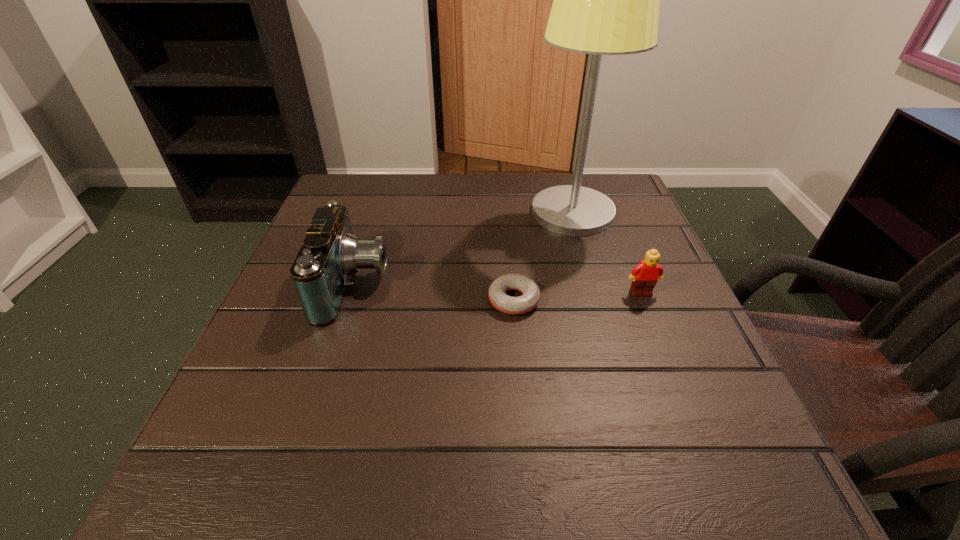
This screenshot has height=540, width=960. In order to click on free space located on the front of the shortest object in this screenshot , I will do `click(531, 508)`.

This screenshot has width=960, height=540. What are the coordinates of `object that is at the far edge` in the screenshot? It's located at (605, 0).

At what (x,y) coordinates should I click in order to perform the action: click on object located at the left edge. Please return your answer as a coordinate pair (x, y). The image size is (960, 540). Looking at the image, I should click on (330, 254).

The width and height of the screenshot is (960, 540). Find the location of `table lamp situated at the right edge`. table lamp situated at the right edge is located at coordinates 605,0.

Identify the location of Lego that is at the right edge. This screenshot has width=960, height=540. (644, 276).

In order to click on object that is at the far right corner in this screenshot , I will do point(605,0).

This screenshot has width=960, height=540. I want to click on free space at the far edge, so click(x=462, y=186).

You are a GUI agent. You are given a task and a screenshot of the screen. Output one action in this format:
    pyautogui.click(x=<x>, y=<y>)
    Task: Click on the free space at the near edge of the desktop
    
    Given the screenshot: What is the action you would take?
    pyautogui.click(x=310, y=476)

Locate an element on the screen. vacant space at the left edge of the desktop is located at coordinates [x=320, y=404].

Where is `vacant space at the right edge`? This screenshot has height=540, width=960. vacant space at the right edge is located at coordinates (627, 243).